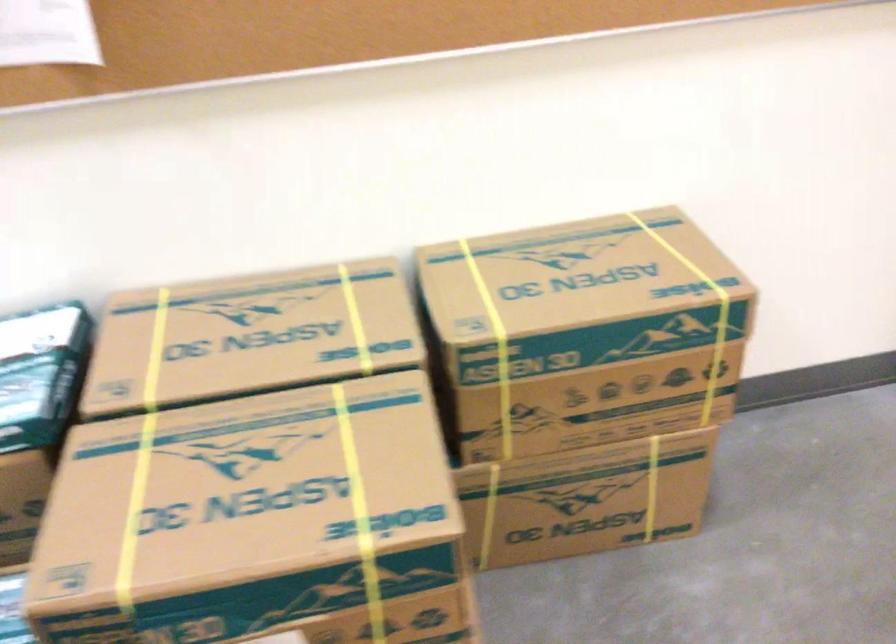
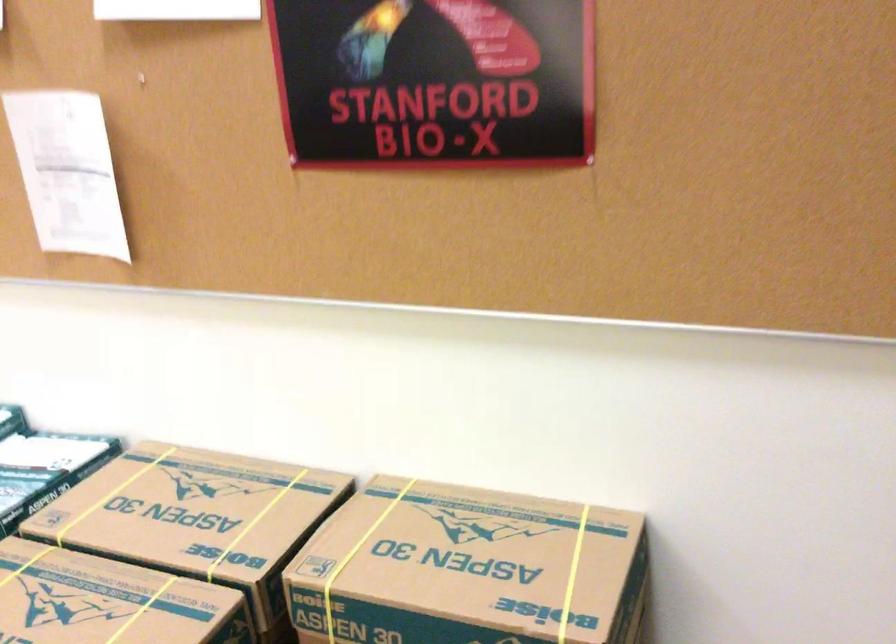
In the second image, find the point that corresponds to (x=599, y=283) in the first image.

(468, 569)